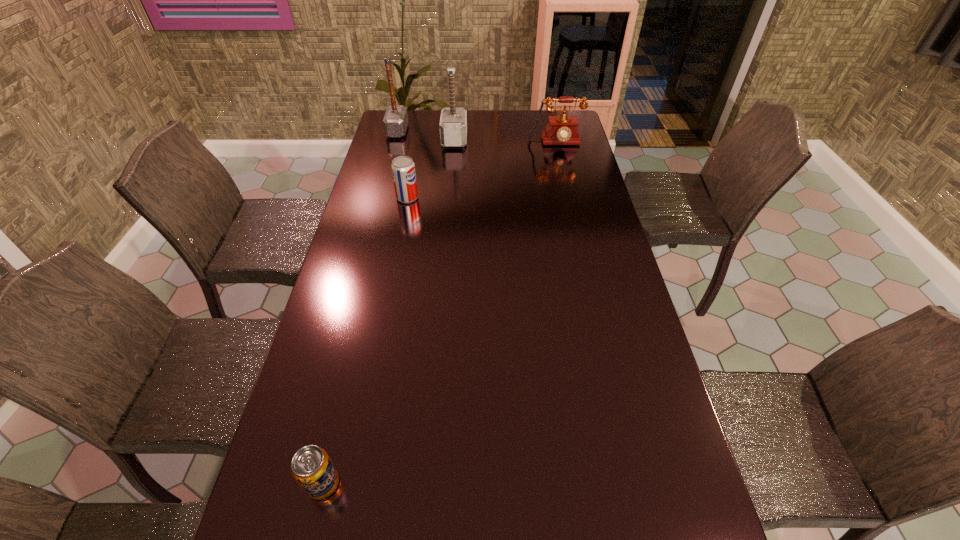
Image resolution: width=960 pixels, height=540 pixels. What are the coordinates of `vacant space that satisfies the following two spatial constraints: 1. on the striking surface of the left hammer; 2. on the left side of the farther soda can` in the screenshot? It's located at (379, 198).

Find the location of a particular element. Image resolution: width=960 pixels, height=540 pixels. free space that satisfies the following two spatial constraints: 1. for striking with the head of the right hammer; 2. on the front side of the farther soda can is located at coordinates (449, 198).